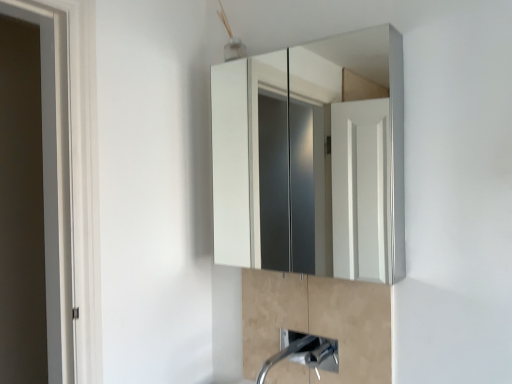
Question: Does point (375, 380) appear closer or farther from the camera than point (332, 362)?

Choices:
 (A) closer
 (B) farther

Answer: (A)

Question: Based on their positions, is satin nickel faucet at lower center located to the left or right of satin nickel faucet at lower center?

Choices:
 (A) right
 (B) left

Answer: (A)

Question: Considering the real-world distances, which object is farthest from the white glossy medicine cabinet at upper center?

Choices:
 (A) satin nickel faucet at lower center
 (B) satin nickel faucet at lower center

Answer: (A)

Question: Estimate the real-world distances between objects in this image. Which object is closer to the satin nickel faucet at lower center?

Choices:
 (A) satin nickel faucet at lower center
 (B) white glossy medicine cabinet at upper center

Answer: (A)